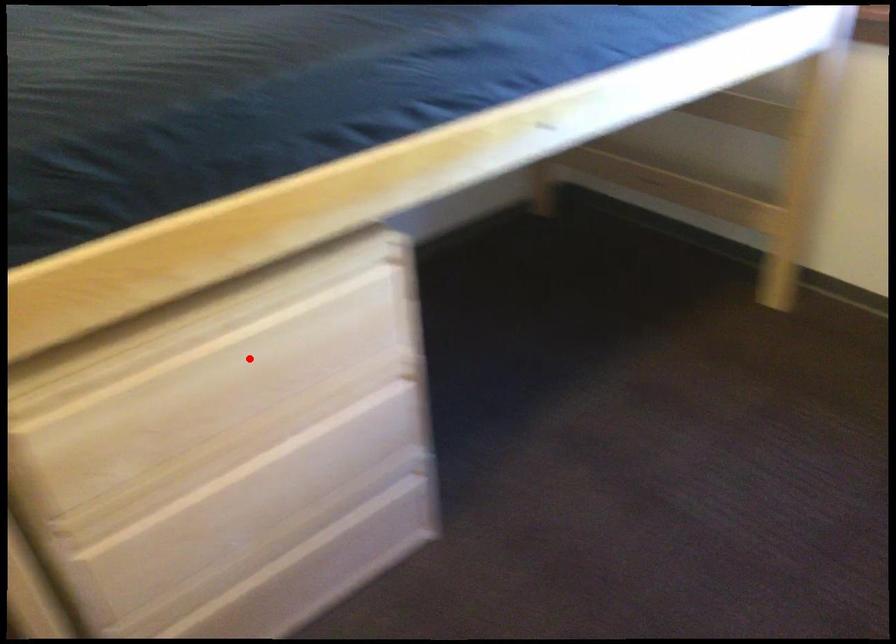
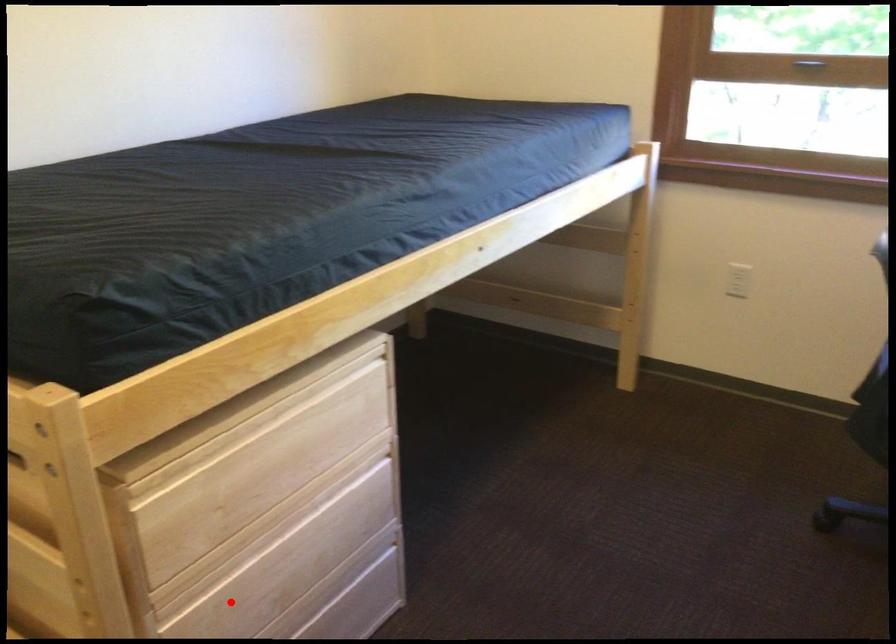
I am providing you with two images of the same scene from different viewpoints. A red point is marked on the first image and another point is marked on the second image. Is the marked point in image1 the same physical position as the marked point in image2?

No